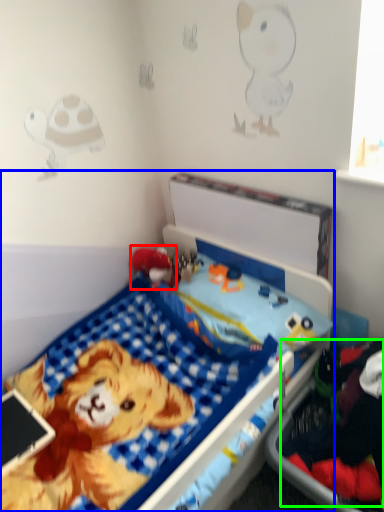
Question: Based on their relative distances, which object is farther from toy (highlighted by a red box)? Choose from bed (highlighted by a blue box) and clothing (highlighted by a green box).

Choices:
 (A) bed
 (B) clothing

Answer: (B)